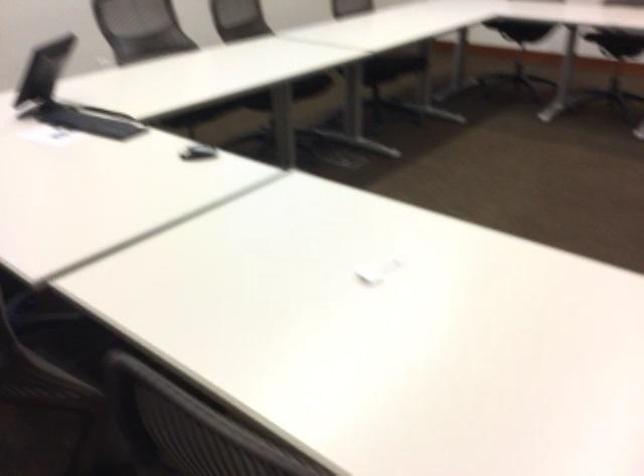
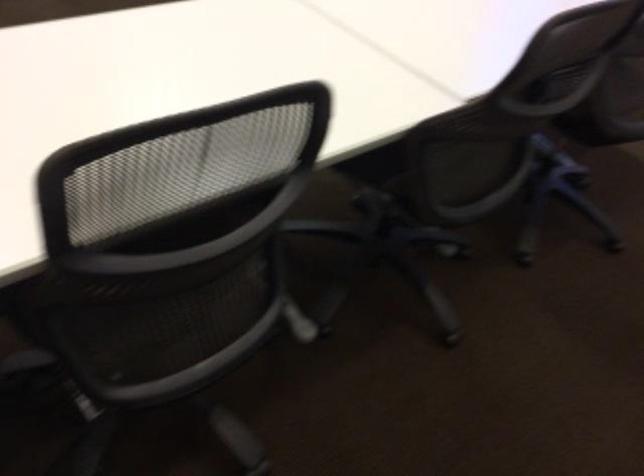
How did the camera likely rotate?

The rotation direction of the camera is right-down.